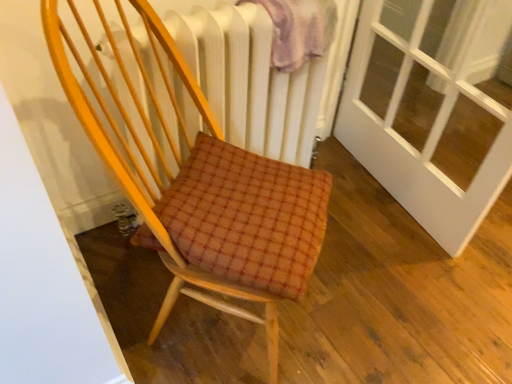
Question: Is plush pink blanket at upper center not within white textured radiator at upper center?

Choices:
 (A) yes
 (B) no

Answer: (B)

Question: From a real-world perspective, is plush pink blanket at upper center beneath white textured radiator at upper center?

Choices:
 (A) yes
 (B) no

Answer: (B)

Question: Considering the relative positions of plush pink blanket at upper center and white textured radiator at upper center in the image provided, is plush pink blanket at upper center to the right of white textured radiator at upper center from the viewer's perspective?

Choices:
 (A) no
 (B) yes

Answer: (B)

Question: Can you confirm if plush pink blanket at upper center is thinner than white textured radiator at upper center?

Choices:
 (A) no
 (B) yes

Answer: (A)

Question: Does plush pink blanket at upper center have a lesser height compared to white textured radiator at upper center?

Choices:
 (A) yes
 (B) no

Answer: (A)

Question: From the image's perspective, would you say plush pink blanket at upper center is shown under white textured radiator at upper center?

Choices:
 (A) no
 (B) yes

Answer: (A)

Question: Would you say wooden chair at center contains plush pink blanket at upper center?

Choices:
 (A) no
 (B) yes

Answer: (A)

Question: Is wooden chair at center completely or partially outside of plush pink blanket at upper center?

Choices:
 (A) yes
 (B) no

Answer: (A)

Question: From the image's perspective, does wooden chair at center appear lower than plush pink blanket at upper center?

Choices:
 (A) no
 (B) yes

Answer: (B)

Question: From the image's perspective, is wooden chair at center located above plush pink blanket at upper center?

Choices:
 (A) no
 (B) yes

Answer: (A)

Question: Is wooden chair at center to the right of plush pink blanket at upper center from the viewer's perspective?

Choices:
 (A) no
 (B) yes

Answer: (A)

Question: Is the surface of wooden chair at center in direct contact with plush pink blanket at upper center?

Choices:
 (A) no
 (B) yes

Answer: (A)

Question: From a real-world perspective, is plush pink blanket at upper center under wooden chair at center?

Choices:
 (A) no
 (B) yes

Answer: (A)